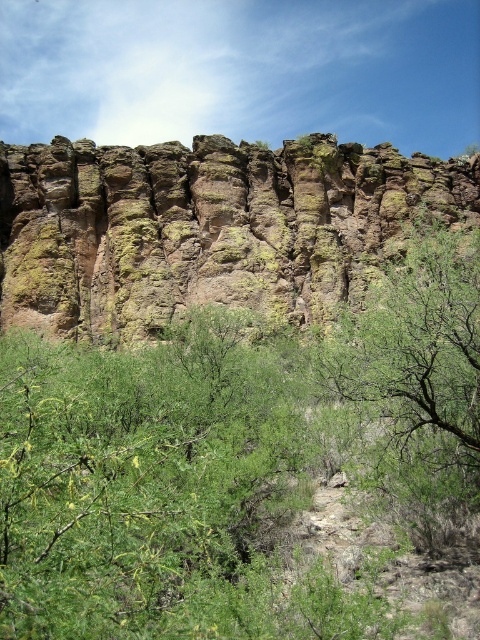
You are a hiker standing at point A and want to reach point B. The coordinates of point A are point (x=52, y=180) and point B are point (x=423, y=360). According to the image, which direction should you move to get closer to point B?

To move from point (x=52, y=180) to point (x=423, y=360), you should move towards the lower right direction since point (x=52, y=180) is behind point (x=423, y=360).

In the scene shown: You are planning to set up a small campsite between the rusty rock cliff at center and the green leafy tree at center. Based on their widths, which object should you place your tent closer to for more space?

The rusty rock cliff at center might be wider than the green leafy tree at center, so placing the tent closer to the green leafy tree at center would provide more space.

You are standing in front of the rusty rock cliff at center and the green leafy tree at center. Which object is closer to you?

The rusty rock cliff at center is closer to you because it is positioned further to the viewer than the green leafy tree at center.